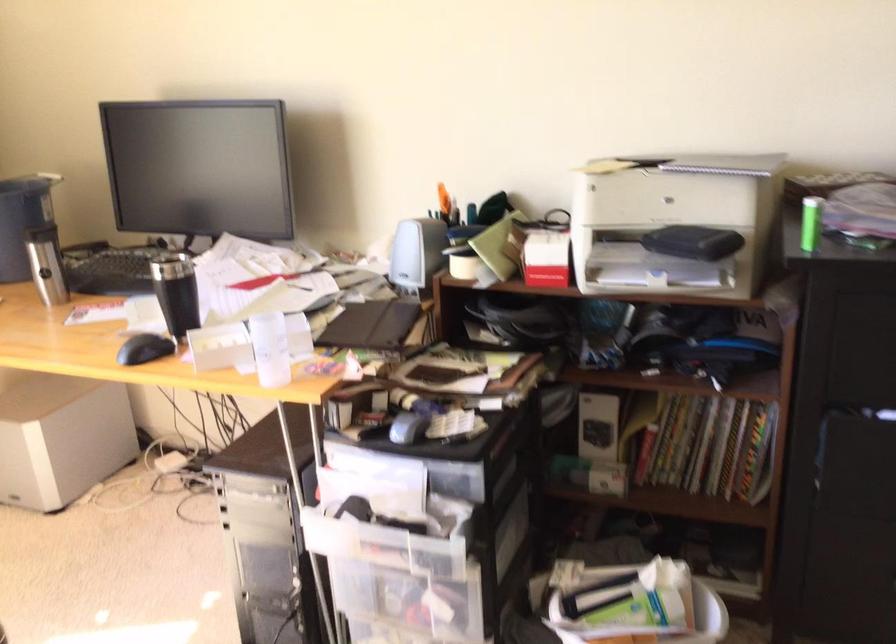
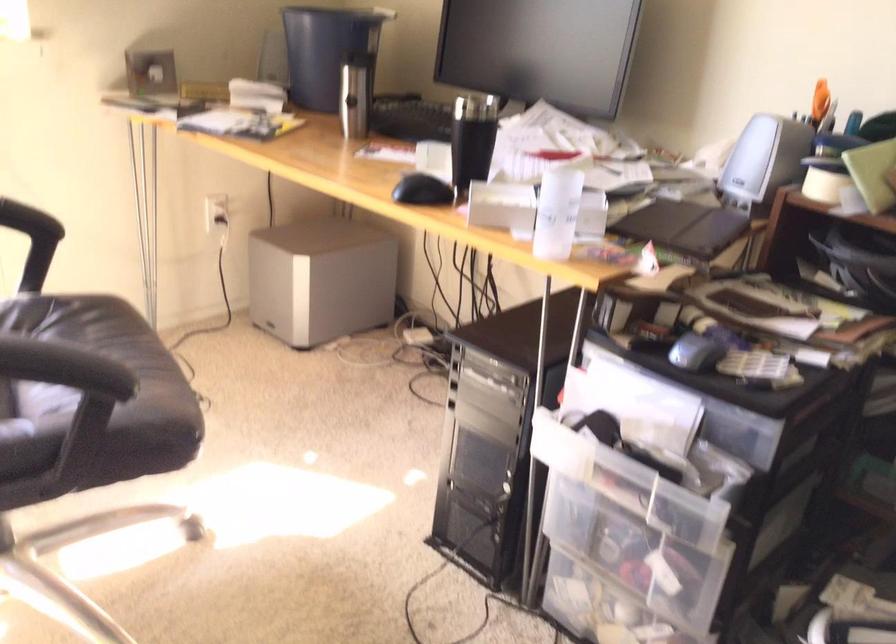
The point at (409, 426) is marked in the first image. Where is the corresponding point in the second image?

(695, 352)